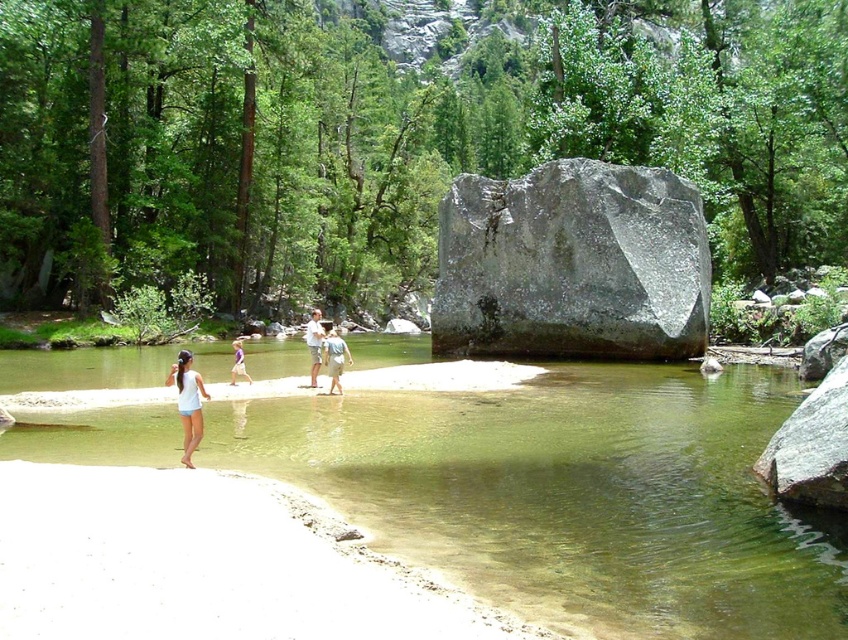
You are a photographer standing at the riverbank. You want to capture a photo of the clear water at center and the light blue denim shorts at center. Which object is closer to the camera?

The clear water at center is shorter than light blue denim shorts at center, so the light blue denim shorts at center is closer to the camera.

You are standing on the sandy riverbank and want to cross the river to the large rock formation. The clear water at center and the light blue denim shorts at center are in your path. Which object is wider, making it harder to cross?

The clear water at center might be wider than light blue denim shorts at center, so the clear water at center is wider and could make crossing more challenging.